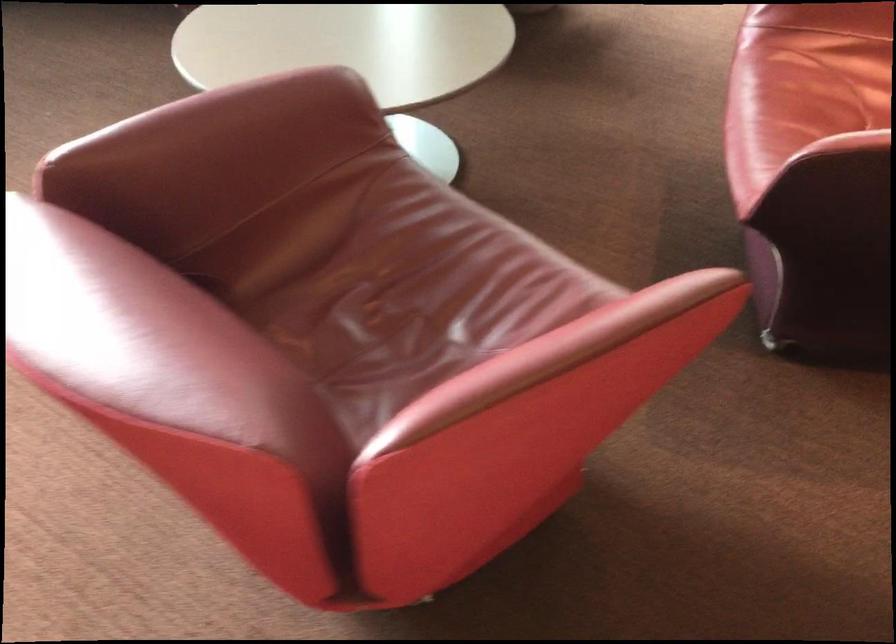
This screenshot has height=644, width=896. Describe the element at coordinates (392, 287) in the screenshot. I see `the red chair sitting surface` at that location.